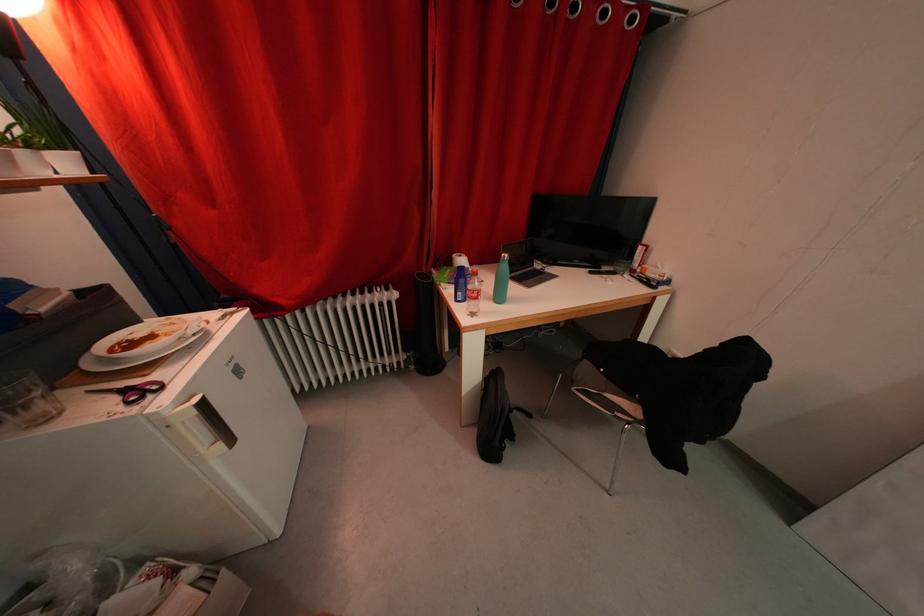
Find where to drink the drinking glass. Please return your answer as a coordinate pair (x, y).

(472, 293)